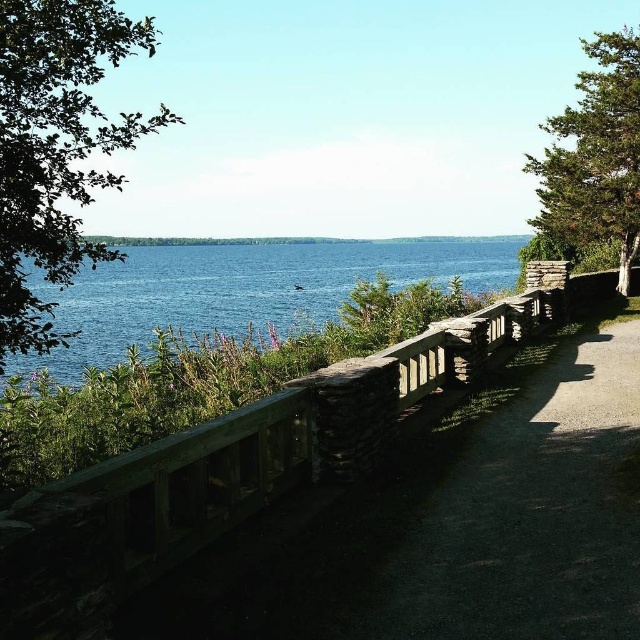
Who is positioned more to the left, green leafy tree at upper left or green textured tree at upper right?

green leafy tree at upper left is more to the left.

Is green leafy tree at upper left behind green textured tree at upper right?

No, green leafy tree at upper left is in front of green textured tree at upper right.

Is point (68, 188) closer to camera compared to point (592, 236)?

Yes.

Find the location of a particular element. This screenshot has height=640, width=640. green leafy tree at upper left is located at coordinates (56, 147).

Can you confirm if wooden path at center is positioned above green leafy tree at upper left?

Incorrect, wooden path at center is not positioned above green leafy tree at upper left.

Is point (385, 595) positioned in front of point (28, 45)?

Yes, point (385, 595) is closer to viewer.

Does point (536, 493) come in front of point (84, 148)?

That is False.

Where is `wooden path at center`? The width and height of the screenshot is (640, 640). wooden path at center is located at coordinates (522, 513).

Is blue water at center taller than green textured tree at upper right?

In fact, blue water at center may be shorter than green textured tree at upper right.

Does blue water at center appear under green textured tree at upper right?

Indeed, blue water at center is positioned under green textured tree at upper right.

Where is `blue water at center`? This screenshot has height=640, width=640. blue water at center is located at coordinates (243, 289).